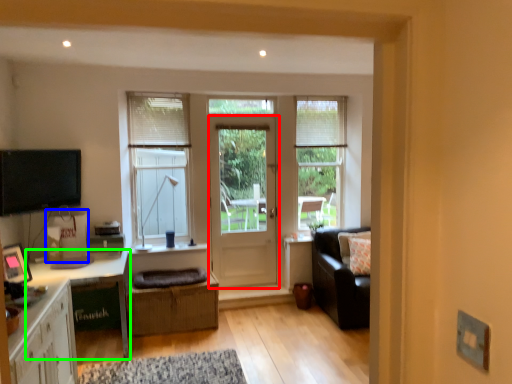
Question: Estimate the real-world distances between objects in this image. Which object is closer to door (highlighted by a red box), cardboard box (highlighted by a blue box) or desk (highlighted by a green box)?

Choices:
 (A) cardboard box
 (B) desk

Answer: (B)